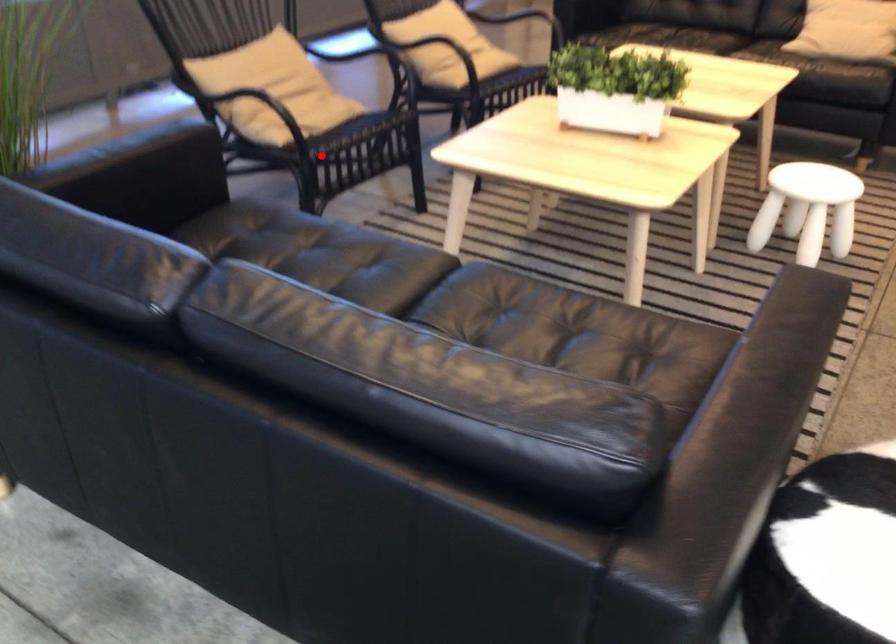
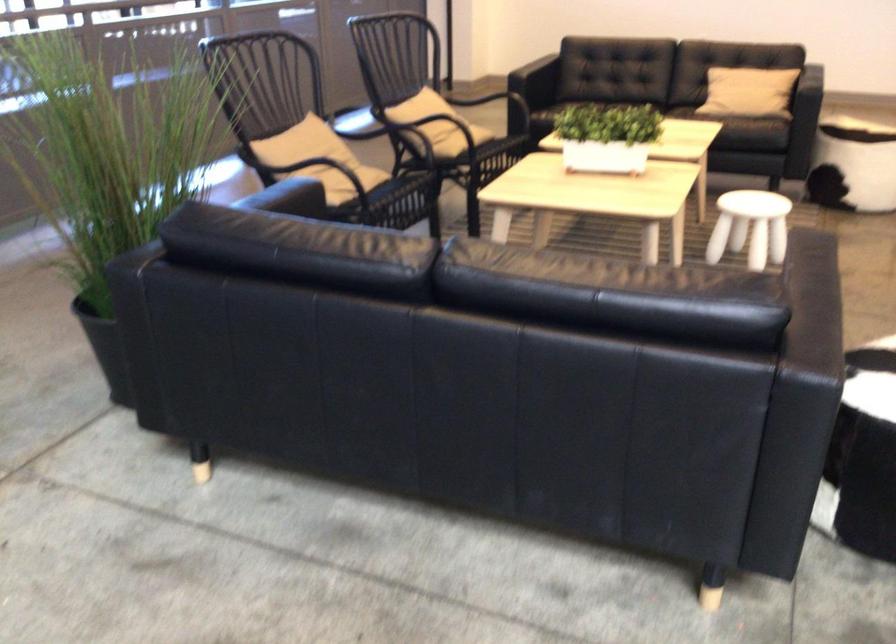
Question: I am providing you with two images of the same scene from different viewpoints. In image1, a red point is highlighted. Considering the same 3D point in image2, which of the following is correct?

Choices:
 (A) It is closer
 (B) It is farther

Answer: (B)